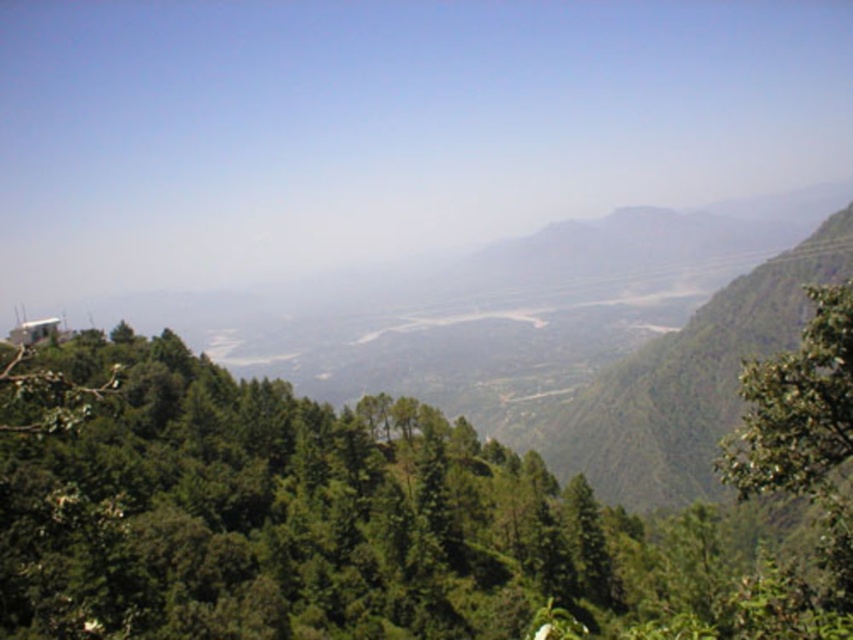
You are standing at the origin point of the image. Which direction should you move to reach the green leafy tree at center?

The green leafy tree at center is located at coordinates point (332,522), so you should move towards the right and slightly upwards from your current position at the origin point to reach it.

You are a hiker standing at the base of the mountain looking towards the valley. You see two green leafy trees in the foreground. Which tree is closer to you, the green leafy tree at center or the green leafy tree at right?

The green leafy tree at center is closer to you because it is positioned under the green leafy tree at right, meaning it is in front of the other tree.

You are a hiker planning to walk through the valley between the green leafy tree at center and the green leafy tree at right. Which tree will you pass closer to as you walk through the valley?

The green leafy tree at center has a lesser width compared to the green leafy tree at right, so you will pass closer to the green leafy tree at center as you walk through the valley.